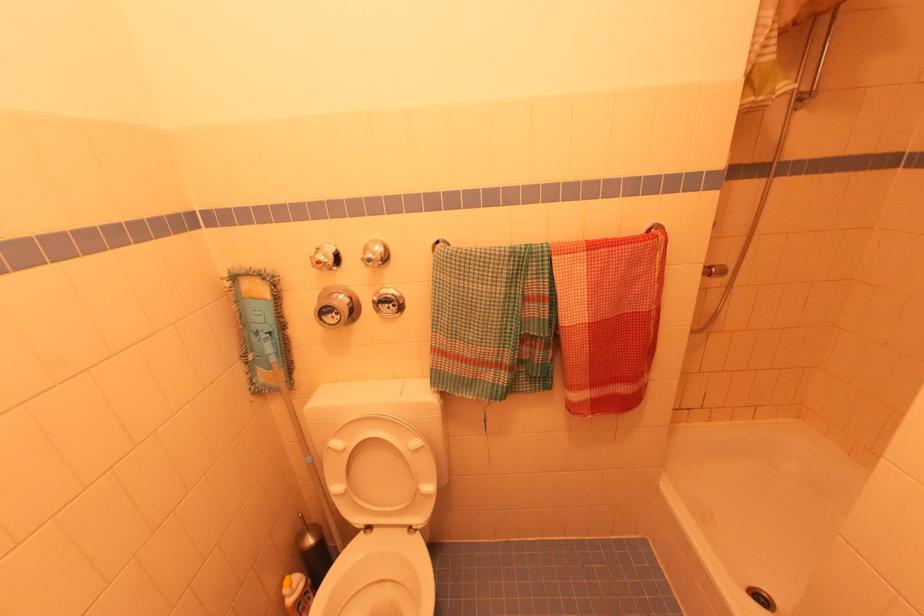
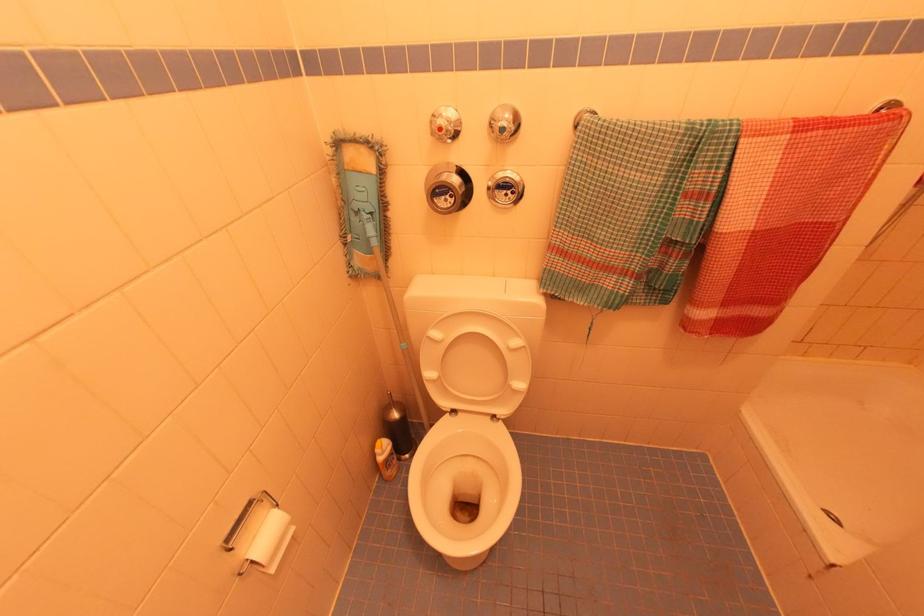
In the second image, find the point that corresponds to (x=334, y=439) in the first image.

(433, 329)